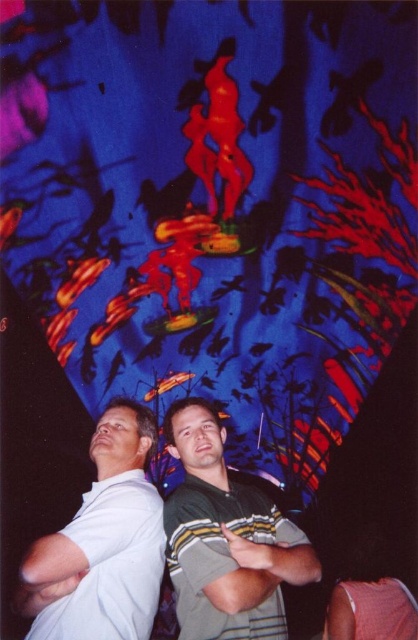
You are standing in a room with a large mural on the wall. You see a person wearing a green striped shirt at center. If you want to take a closer look at the mural, how many steps should you take backward to ensure you can see the entire mural without moving your head?

The green striped shirt at center is 5.07 meters away from the viewer. To see the entire mural, you should take 3 steps back to be approximately 6 meters away, ensuring the mural fits within your field of view.

You are a photographer trying to capture a group photo. You notice the green striped shirt at center and the white cotton shirt at left. Which person should stand on a stool to ensure both are visible in the frame?

The white cotton shirt at left should stand on a stool because the green striped shirt at center is taller than the white cotton shirt at left, so elevating the shorter one will balance their heights in the photo.

You are a photographer trying to adjust the lighting for a photo shoot. You notice the green striped shirt at center and the white cotton shirt at left. Which shirt is positioned lower in the frame?

The green striped shirt at center is located below the white cotton shirt at left, so the green striped shirt at center is positioned lower in the frame.